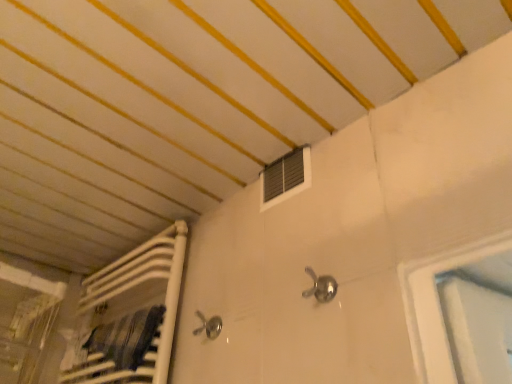
Question: Is satin nickel faucet at center spatially inside metallic silver air conditioning at upper center, or outside of it?

Choices:
 (A) outside
 (B) inside

Answer: (A)

Question: From the image's perspective, is satin nickel faucet at center positioned above or below metallic silver air conditioning at upper center?

Choices:
 (A) below
 (B) above

Answer: (A)

Question: From a real-world perspective, is satin nickel faucet at center physically located above or below metallic silver air conditioning at upper center?

Choices:
 (A) above
 (B) below

Answer: (B)

Question: Choose the correct answer: Is metallic silver air conditioning at upper center inside satin nickel faucet at center or outside it?

Choices:
 (A) inside
 (B) outside

Answer: (B)

Question: Based on their sizes in the image, would you say metallic silver air conditioning at upper center is bigger or smaller than satin nickel faucet at center?

Choices:
 (A) big
 (B) small

Answer: (A)

Question: From the image's perspective, relative to satin nickel faucet at center, is metallic silver air conditioning at upper center above or below?

Choices:
 (A) below
 (B) above

Answer: (B)

Question: In terms of height, does metallic silver air conditioning at upper center look taller or shorter compared to satin nickel faucet at center?

Choices:
 (A) tall
 (B) short

Answer: (A)